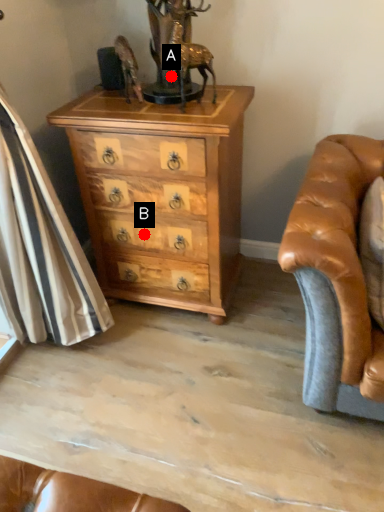
Question: Two points are circled on the image, labeled by A and B beside each circle. Which point is farther to the camera?

Choices:
 (A) A is further
 (B) B is further

Answer: (B)